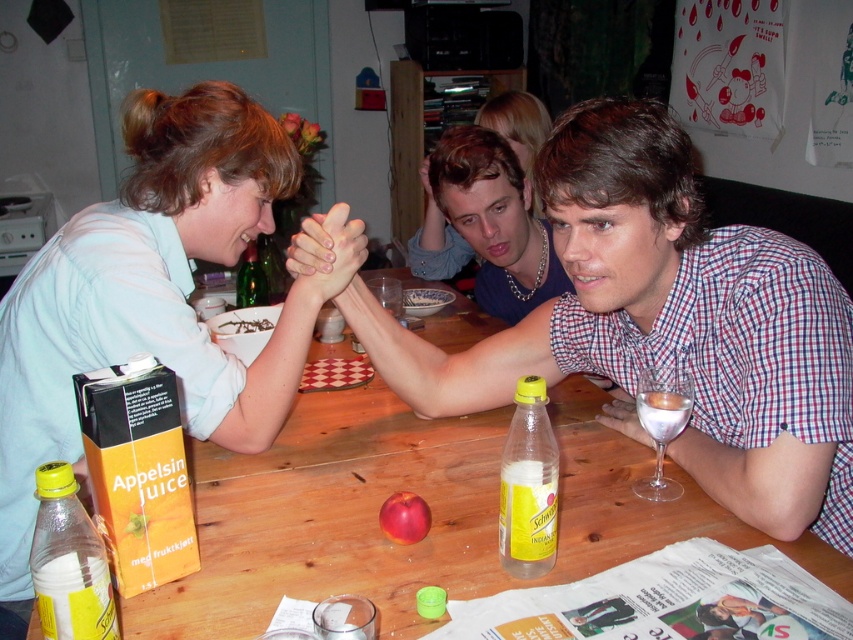
Question: Which of the following is the farthest from the observer?

Choices:
 (A) green glass bottle at upper left
 (B) yellow plastic bottle at center
 (C) checkered fabric shirt at center
 (D) clear glass wine glass at right

Answer: (A)

Question: Considering the real-world distances, which object is closest to the matte light blue shirt at upper left?

Choices:
 (A) yellow plastic bottle at center
 (B) clear glass wine glass at right

Answer: (A)

Question: Estimate the real-world distances between objects in this image. Which object is closer to the wooden table at center?

Choices:
 (A) transparent glass at center
 (B) yellow matte bottle at lower left
 (C) clear glass wine at right

Answer: (C)

Question: Observing the image, what is the correct spatial positioning of wooden table at center in reference to green glass bottle at upper left?

Choices:
 (A) right
 (B) left

Answer: (A)

Question: Is clear glass wine glass at right behind transparent glass at center?

Choices:
 (A) yes
 (B) no

Answer: (B)

Question: Is wooden table at center wider than transparent glass at center?

Choices:
 (A) no
 (B) yes

Answer: (B)